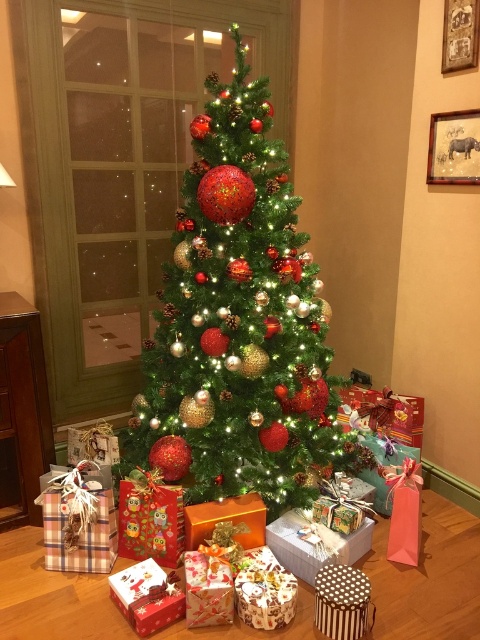
Does matte red gift bag at center have a lesser width compared to patterned paper gift at center?

In fact, matte red gift bag at center might be wider than patterned paper gift at center.

Measure the distance between point (124, 504) and camera.

Point (124, 504) and camera are 6.86 feet apart from each other.

Does point (144, 502) come farther from viewer compared to point (226, 572)?

Yes, point (144, 502) is behind point (226, 572).

You are a GUI agent. You are given a task and a screenshot of the screen. Output one action in this format:
    pyautogui.click(x=<x>, y=<y>)
    Task: Click on the matte red gift bag at center
    The width and height of the screenshot is (480, 640).
    Given the screenshot: What is the action you would take?
    click(x=151, y=522)

This screenshot has width=480, height=640. What do you see at coordinates (240, 323) in the screenshot? I see `shiny metallic tree at center` at bounding box center [240, 323].

Is shiny metallic tree at center closer to the viewer compared to plaid fabric gift at lower left?

No, shiny metallic tree at center is further to the viewer.

Is point (227, 428) behind point (45, 483)?

Yes, it is behind point (45, 483).

Identify the location of shiny metallic tree at center. (240, 323).

Which of these two, shiny metallic tree at center or matte red gift bag at center, stands taller?

Standing taller between the two is shiny metallic tree at center.

Does shiny metallic tree at center appear over matte red gift bag at center?

Yes.

Is point (240, 216) farther from camera compared to point (135, 556)?

No.

Locate an element on the screen. Image resolution: width=480 pixels, height=640 pixels. shiny metallic tree at center is located at coordinates (240, 323).